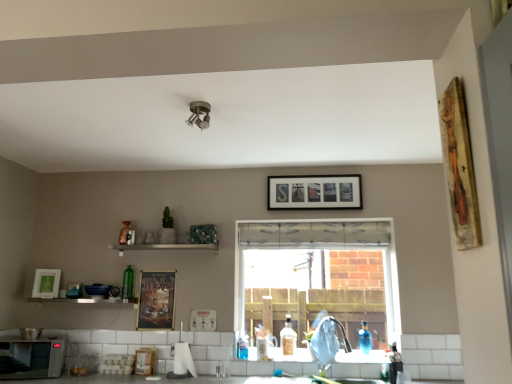
What are the coordinates of `translucent glass bottle at sink, which appears as the 3th bottle when viewed from the right` in the screenshot? It's located at (288, 337).

Describe the element at coordinates (365, 338) in the screenshot. I see `blue glass bottle at lower right, which is the 3th bottle from back to front` at that location.

This screenshot has height=384, width=512. What do you see at coordinates (394, 364) in the screenshot?
I see `translucent plastic bottle at lower right, the 4th bottle when ordered from left to right` at bounding box center [394, 364].

Identify the location of translucent glass bottle at sink, arranged as the 3th bottle when viewed from the front. Image resolution: width=512 pixels, height=384 pixels. (288, 337).

Is metallic silver picture frame at lower center, the 3th picture frame when ordered from left to right, completely or partially outside of wooden framed letters at upper center, the 2th picture frame when ordered from top to bottom?

Yes, metallic silver picture frame at lower center, the 3th picture frame when ordered from left to right, is not within wooden framed letters at upper center, the 2th picture frame when ordered from top to bottom.

Find the location of a particular element. Image resolution: width=512 pixels, height=384 pixels. picture frame that is the 3rd one when counting upward from the metallic silver picture frame at lower center, the 3th picture frame when ordered from left to right (from the image's perspective) is located at coordinates (314, 192).

Is point (214, 327) in front of point (283, 197)?

Yes, it is.

Are metallic silver picture frame at lower center, the second picture frame when ordered from front to back, and wooden framed letters at upper center, which is the 4th picture frame from left to right, far apart?

Yes, metallic silver picture frame at lower center, the second picture frame when ordered from front to back, and wooden framed letters at upper center, which is the 4th picture frame from left to right, are located far from each other.

Could you measure the distance between metallic silver shelf at lower center and translucent plastic bottle at lower right, which appears as the first bottle when viewed from the right?

metallic silver shelf at lower center is 7.01 feet away from translucent plastic bottle at lower right, which appears as the first bottle when viewed from the right.

Is metallic silver shelf at lower center shorter than translucent plastic bottle at lower right, the fourth bottle positioned from the back?

Correct, metallic silver shelf at lower center is not as tall as translucent plastic bottle at lower right, the fourth bottle positioned from the back.

How many degrees apart are the facing directions of metallic silver shelf at lower center and translucent plastic bottle at lower right, which appears as the first bottle when viewed from the right?

There is a 2.76-degree angle between the facing directions of metallic silver shelf at lower center and translucent plastic bottle at lower right, which appears as the first bottle when viewed from the right.

Is metallic silver shelf at lower center facing away from translucent plastic bottle at lower right, the 4th bottle when ordered from left to right?

No, metallic silver shelf at lower center's orientation is not away from translucent plastic bottle at lower right, the 4th bottle when ordered from left to right.

Is wooden painting at upper right, which is the fifth picture frame from bottom to top, further to camera compared to satin nickel spotlight at center?

No, the depth of wooden painting at upper right, which is the fifth picture frame from bottom to top, is less than that of satin nickel spotlight at center.

Between point (472, 183) and point (188, 124), which one is positioned in front?

The point (472, 183) is in front.

Can you tell me how much wooden painting at upper right, which is the fifth picture frame from bottom to top, and satin nickel spotlight at center differ in facing direction?

The angular difference between wooden painting at upper right, which is the fifth picture frame from bottom to top, and satin nickel spotlight at center is 96.4 degrees.

From the image's perspective, does wooden painting at upper right, which is the fifth picture frame from back to front, appear lower than satin nickel spotlight at center?

Indeed, from the image's perspective, wooden painting at upper right, which is the fifth picture frame from back to front, is shown beneath satin nickel spotlight at center.

Does point (198, 123) lie in front of point (280, 335)?

That is True.

Measure the distance from satin nickel spotlight at center to translucent glass bottle at sink, which is counted as the 2th bottle, starting from the left.

1.90 meters.

Based on the photo, is translucent glass bottle at sink, arranged as the 3th bottle when viewed from the front, a part of satin nickel spotlight at center?

Actually, translucent glass bottle at sink, arranged as the 3th bottle when viewed from the front, is outside satin nickel spotlight at center.

Is satin nickel spotlight at center thinner than translucent glass bottle at sink, placed as the 2th bottle when sorted from back to front?

No, satin nickel spotlight at center is not thinner than translucent glass bottle at sink, placed as the 2th bottle when sorted from back to front.

From a real-world perspective, is white fabric window at center on top of translucent plastic bottle at lower right, the 4th bottle when ordered from left to right?

Indeed, from a real-world perspective, white fabric window at center stands above translucent plastic bottle at lower right, the 4th bottle when ordered from left to right.

Which point is more forward, (377, 327) or (398, 352)?

The point (398, 352) is closer.

Visually, is white fabric window at center positioned to the left or to the right of translucent plastic bottle at lower right, the 4th bottle when ordered from left to right?

white fabric window at center is positioned on translucent plastic bottle at lower right, the 4th bottle when ordered from left to right,'s left side.

Considering the relative positions of white fabric window at center and translucent plastic bottle at lower right, which appears as the first bottle when viewed from the right, in the image provided, is white fabric window at center behind translucent plastic bottle at lower right, which appears as the first bottle when viewed from the right,?

Yes, white fabric window at center is further from the viewer.

Considering the relative sizes of metallic poster at center, the 4th picture frame viewed from the top, and metallic silver shelf at lower center in the image provided, is metallic poster at center, the 4th picture frame viewed from the top, shorter than metallic silver shelf at lower center?

Incorrect, the height of metallic poster at center, the 4th picture frame viewed from the top, does not fall short of that of metallic silver shelf at lower center.

Does metallic poster at center, which appears as the 2th picture frame when viewed from the back, come in front of metallic silver shelf at lower center?

No, metallic poster at center, which appears as the 2th picture frame when viewed from the back, is further to the viewer.

Which is farther, [170,324] or [128,303]?

The point [128,303] is behind.

How many degrees apart are the facing directions of metallic poster at center, the second picture frame viewed from the left, and metallic silver shelf at lower center?

0.928 degrees separate the facing orientations of metallic poster at center, the second picture frame viewed from the left, and metallic silver shelf at lower center.

Is matte silver microwave at lower left wider than metallic silver shelf at lower center?

Yes, matte silver microwave at lower left is wider than metallic silver shelf at lower center.

Does matte silver microwave at lower left lie in front of metallic silver shelf at lower center?

That is True.

From the image's perspective, is matte silver microwave at lower left on metallic silver shelf at lower center?

No.

Is matte silver microwave at lower left positioned with its back to metallic silver shelf at lower center?

No, matte silver microwave at lower left is not facing away from metallic silver shelf at lower center.

In order to click on the 1st picture frame to the right of the metallic silver picture frame at lower center, the 4th picture frame viewed from the back, counting from the anchor's position in this screenshot , I will do `click(314, 192)`.

The height and width of the screenshot is (384, 512). Find the location of `shelf on the left side of translucent plastic bottle at lower right, the 4th bottle when ordered from left to right`. shelf on the left side of translucent plastic bottle at lower right, the 4th bottle when ordered from left to right is located at coordinates (84, 300).

Which object lies nearer to the anchor point green glass bottle at shelf, placed as the 4th bottle when sorted from front to back, wooden framed letters at upper center, the 2th picture frame when ordered from top to bottom, or matte silver microwave at lower left?

matte silver microwave at lower left is positioned closer to the anchor green glass bottle at shelf, placed as the 4th bottle when sorted from front to back.

From the image, which object appears to be farther from metallic silver picture frame at lower center, the 4th picture frame viewed from the back, white matte picture frame at left, arranged as the 3th picture frame when viewed from the top, or metallic silver shelf at lower center?

white matte picture frame at left, arranged as the 3th picture frame when viewed from the top.

From the image, which object appears to be nearer to wooden framed letters at upper center, which is the 4th picture frame from left to right, wooden painting at upper right, arranged as the 1th picture frame when viewed from the right, or metallic silver shelf at lower center?

The object closer to wooden framed letters at upper center, which is the 4th picture frame from left to right, is metallic silver shelf at lower center.

Based on the photo, which object lies further to the anchor point metallic silver picture frame at lower center, the first picture frame in the bottom-to-top sequence, matte silver microwave at lower left or white fabric window at center?

white fabric window at center lies further to metallic silver picture frame at lower center, the first picture frame in the bottom-to-top sequence, than the other object.

When comparing their distances from green glass bottle at shelf, the fourth bottle from the right, does translucent glass bottle at sink, which is counted as the 2th bottle, starting from the left, or metallic silver picture frame at lower center, the second picture frame when ordered from front to back, seem closer?

Based on the image, metallic silver picture frame at lower center, the second picture frame when ordered from front to back, appears to be nearer to green glass bottle at shelf, the fourth bottle from the right.

Which object lies further to the anchor point white fabric window at center, metallic poster at center, which appears as the fourth picture frame when viewed from the right, or blue glass bottle at lower right, the 2th bottle in the front-to-back sequence?

metallic poster at center, which appears as the fourth picture frame when viewed from the right, is positioned further to the anchor white fabric window at center.

Based on their spatial positions, is metallic poster at center, the 4th picture frame viewed from the top, or blue glass bottle at lower right, the 2th bottle in the front-to-back sequence, closer to translucent glass bottle at sink, which is counted as the 2th bottle, starting from the left?

blue glass bottle at lower right, the 2th bottle in the front-to-back sequence, is closer to translucent glass bottle at sink, which is counted as the 2th bottle, starting from the left.

From the image, which object appears to be nearer to metallic silver picture frame at lower center, the 3th picture frame when ordered from left to right, matte silver microwave at lower left or wooden painting at upper right, which ranks as the first picture frame in top-to-bottom order?

matte silver microwave at lower left.

I want to click on light fixture between metallic silver shelf at lower center and blue glass bottle at lower right, the 2th bottle in the front-to-back sequence, in the horizontal direction, so click(x=199, y=114).

Locate an element on the screen. The height and width of the screenshot is (384, 512). light fixture between metallic poster at center, marked as the 4th picture frame in a front-to-back arrangement, and blue glass bottle at lower right, which is the 3th bottle from back to front, from left to right is located at coordinates (199, 114).

Where is `light fixture between wooden painting at upper right, arranged as the 1th picture frame when viewed from the right, and metallic poster at center, which appears as the fourth picture frame when viewed from the right, in the front-back direction`? This screenshot has width=512, height=384. light fixture between wooden painting at upper right, arranged as the 1th picture frame when viewed from the right, and metallic poster at center, which appears as the fourth picture frame when viewed from the right, in the front-back direction is located at coordinates (199, 114).

Where is `bottle situated between metallic silver picture frame at lower center, placed as the 5th picture frame when sorted from top to bottom, and white fabric window at center from left to right`? The width and height of the screenshot is (512, 384). bottle situated between metallic silver picture frame at lower center, placed as the 5th picture frame when sorted from top to bottom, and white fabric window at center from left to right is located at coordinates (288, 337).